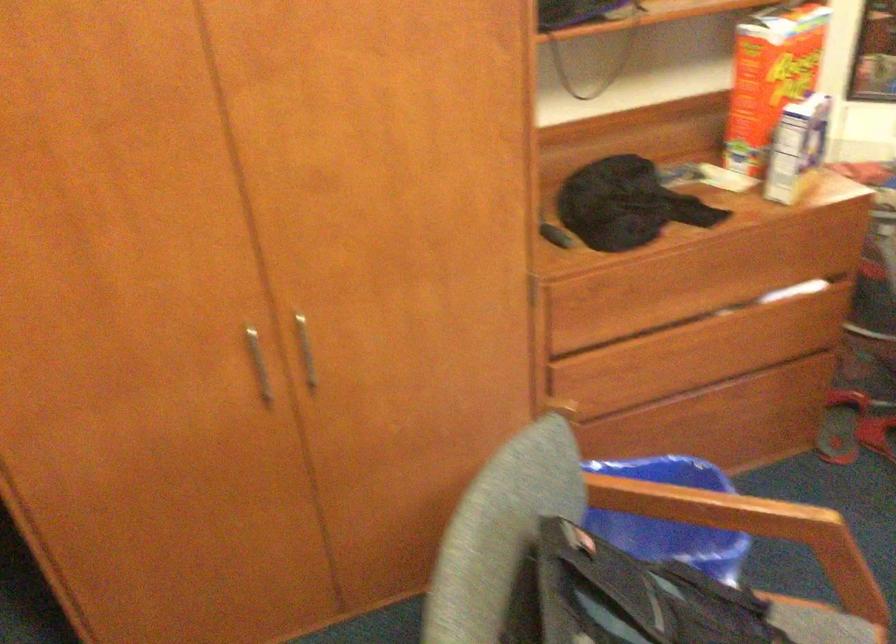
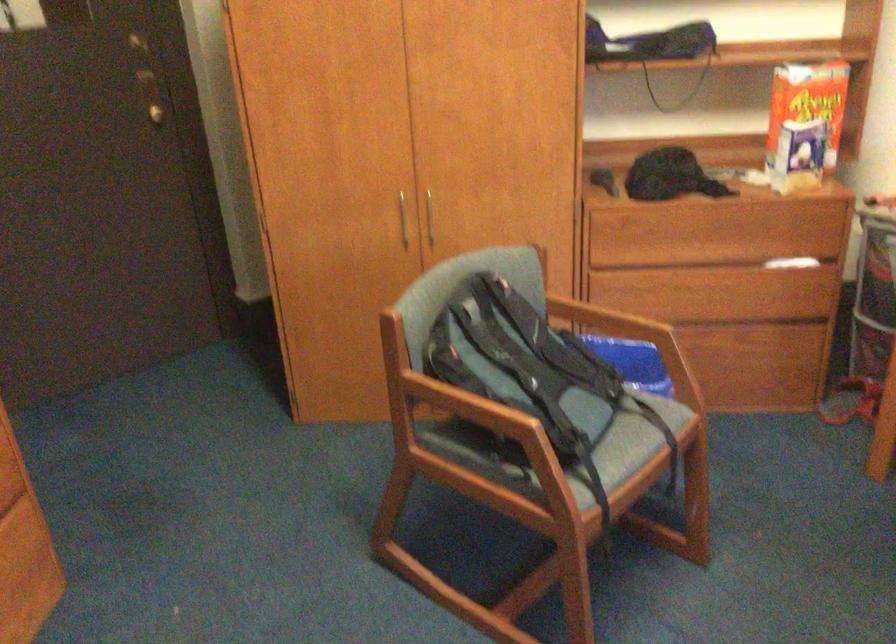
Locate, in the second image, the point that corresponds to point (691, 279) in the first image.

(702, 232)